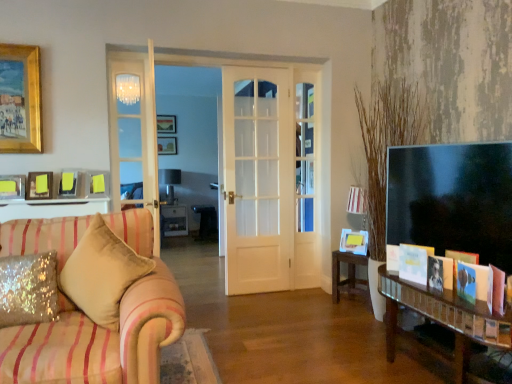
The height and width of the screenshot is (384, 512). I want to click on vacant region below wooden table at center, which appears as the 2th table when viewed from the left (from a real-world perspective), so click(352, 305).